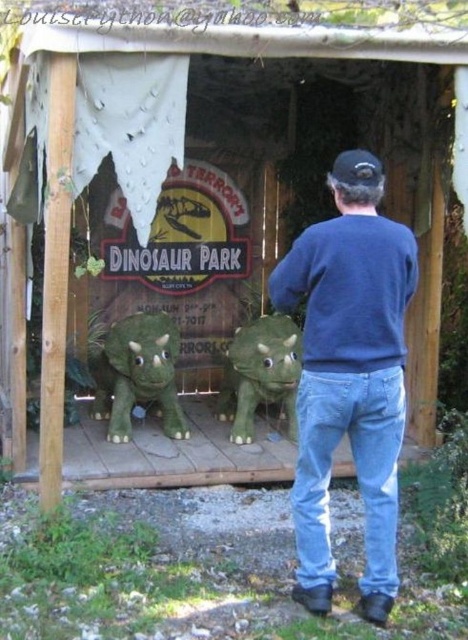
You are a visitor at the Terror T Dinosaur Park entrance. You notice a blue cotton sweater at center and a green matte dinosaur at center. Which object is taller?

The blue cotton sweater at center is taller than the green matte dinosaur at center.

You are a visitor at the dinosaur park entrance and see both the blue cotton sweater at center and the green plush dinosaur at center. According to the layout, which object is positioned to the right of the other?

The blue cotton sweater at center is to the right of the green plush dinosaur at center.